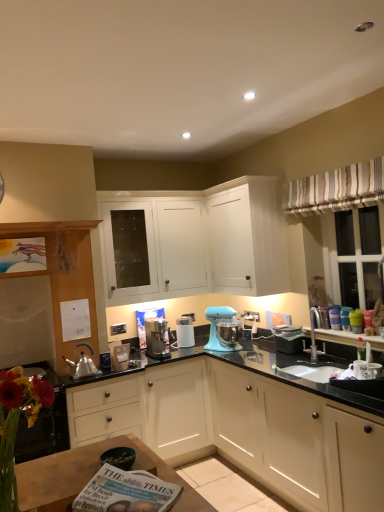
Find the location of `blank space above wooden table at lower left (from a real-world perspective)`. blank space above wooden table at lower left (from a real-world perspective) is located at coordinates (71, 463).